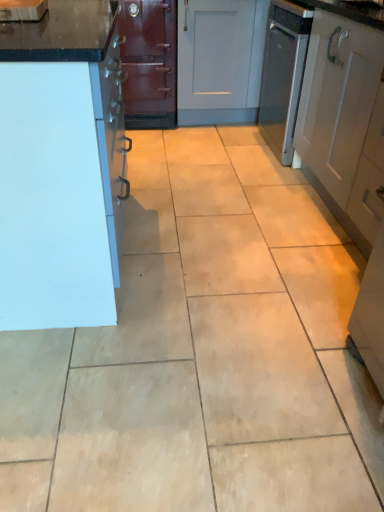
What do you see at coordinates (61, 167) in the screenshot? I see `white matte cabinet at left, which appears as the second cabinetry when viewed from the right` at bounding box center [61, 167].

Based on the photo, what is the approximate width of white matte cabinet at left, the 1th cabinetry from the left?

white matte cabinet at left, the 1th cabinetry from the left, is 75.01 centimeters wide.

Find the location of a particular element. This screenshot has height=512, width=384. white matte cabinet at left, which appears as the second cabinetry when viewed from the right is located at coordinates (61, 167).

This screenshot has height=512, width=384. What do you see at coordinates (342, 113) in the screenshot?
I see `white matte cabinet at right, which is the first cabinetry from right to left` at bounding box center [342, 113].

Measure the distance between white matte cabinet at right, positioned as the 2th cabinetry in left-to-right order, and camera.

white matte cabinet at right, positioned as the 2th cabinetry in left-to-right order, and camera are 1.54 meters apart.

This screenshot has width=384, height=512. I want to click on white matte cabinet at right, which is the first cabinetry from right to left, so click(342, 113).

Where is `white matte cabinet at left, which appears as the second cabinetry when viewed from the right`? white matte cabinet at left, which appears as the second cabinetry when viewed from the right is located at coordinates (61, 167).

Is white matte cabinet at left, which appears as the second cabinetry when viewed from the right, at the right side of white matte cabinet at right, which is the first cabinetry from right to left?

In fact, white matte cabinet at left, which appears as the second cabinetry when viewed from the right, is to the left of white matte cabinet at right, which is the first cabinetry from right to left.

Considering the relative positions of white matte cabinet at left, which appears as the second cabinetry when viewed from the right, and white matte cabinet at right, positioned as the 2th cabinetry in left-to-right order, in the image provided, is white matte cabinet at left, which appears as the second cabinetry when viewed from the right, in front of white matte cabinet at right, positioned as the 2th cabinetry in left-to-right order,?

That is True.

Which is in front, point (57, 5) or point (379, 216)?

The point (379, 216) is closer.

From the image's perspective, which object appears higher, white matte cabinet at left, the 1th cabinetry from the left, or white matte cabinet at right, which is the first cabinetry from right to left?

white matte cabinet at right, which is the first cabinetry from right to left, is shown above in the image.

From a real-world perspective, is white matte cabinet at left, the 1th cabinetry from the left, physically located above or below white matte cabinet at right, which is the first cabinetry from right to left?

white matte cabinet at left, the 1th cabinetry from the left, is situated lower than white matte cabinet at right, which is the first cabinetry from right to left, in the real world.

Which of these two, white matte cabinet at left, which appears as the second cabinetry when viewed from the right, or white matte cabinet at right, which is the first cabinetry from right to left, is thinner?

With smaller width is white matte cabinet at right, which is the first cabinetry from right to left.

Considering the sizes of white matte cabinet at left, the 1th cabinetry from the left, and white matte cabinet at right, which is the first cabinetry from right to left, in the image, is white matte cabinet at left, the 1th cabinetry from the left, taller or shorter than white matte cabinet at right, which is the first cabinetry from right to left,?

Clearly, white matte cabinet at left, the 1th cabinetry from the left, is shorter compared to white matte cabinet at right, which is the first cabinetry from right to left.

Based on their sizes in the image, would you say white matte cabinet at left, which appears as the second cabinetry when viewed from the right, is bigger or smaller than white matte cabinet at right, positioned as the 2th cabinetry in left-to-right order?

In the image, white matte cabinet at left, which appears as the second cabinetry when viewed from the right, appears to be larger than white matte cabinet at right, positioned as the 2th cabinetry in left-to-right order.

Is white matte cabinet at left, the 1th cabinetry from the left, surrounding white matte cabinet at right, positioned as the 2th cabinetry in left-to-right order?

Actually, white matte cabinet at right, positioned as the 2th cabinetry in left-to-right order, is outside white matte cabinet at left, the 1th cabinetry from the left.

Is white matte cabinet at left, which appears as the second cabinetry when viewed from the right, directly adjacent to white matte cabinet at right, which is the first cabinetry from right to left?

white matte cabinet at left, which appears as the second cabinetry when viewed from the right, is not next to white matte cabinet at right, which is the first cabinetry from right to left, and they're not touching.

Is white matte cabinet at left, which appears as the second cabinetry when viewed from the right, oriented away from white matte cabinet at right, positioned as the 2th cabinetry in left-to-right order?

Yes, white matte cabinet at left, which appears as the second cabinetry when viewed from the right, is positioned with its back facing white matte cabinet at right, positioned as the 2th cabinetry in left-to-right order.

Could you measure the distance between white matte cabinet at left, which appears as the second cabinetry when viewed from the right, and white matte cabinet at right, which is the first cabinetry from right to left?

The distance of white matte cabinet at left, which appears as the second cabinetry when viewed from the right, from white matte cabinet at right, which is the first cabinetry from right to left, is 1.04 meters.

I want to click on cabinetry located below the white matte cabinet at right, positioned as the 2th cabinetry in left-to-right order (from the image's perspective), so click(61, 167).

Visually, is white matte cabinet at right, positioned as the 2th cabinetry in left-to-right order, positioned to the left or to the right of white matte cabinet at left, the 1th cabinetry from the left?

white matte cabinet at right, positioned as the 2th cabinetry in left-to-right order, is positioned on white matte cabinet at left, the 1th cabinetry from the left,'s right side.

Considering the relative positions of white matte cabinet at right, which is the first cabinetry from right to left, and white matte cabinet at left, the 1th cabinetry from the left, in the image provided, is white matte cabinet at right, which is the first cabinetry from right to left, behind white matte cabinet at left, the 1th cabinetry from the left,?

Yes, the depth of white matte cabinet at right, which is the first cabinetry from right to left, is greater than that of white matte cabinet at left, the 1th cabinetry from the left.

Which point is more distant from viewer, (312, 63) or (91, 268)?

A: The point (312, 63) is farther from the camera.

From the image's perspective, is white matte cabinet at right, which is the first cabinetry from right to left, on white matte cabinet at left, which appears as the second cabinetry when viewed from the right?

Yes, from the image's perspective, white matte cabinet at right, which is the first cabinetry from right to left, is over white matte cabinet at left, which appears as the second cabinetry when viewed from the right.

From a real-world perspective, which object rests below the other?

In real-world perspective, white matte cabinet at left, which appears as the second cabinetry when viewed from the right, is lower.

Considering the sizes of objects white matte cabinet at right, which is the first cabinetry from right to left, and white matte cabinet at left, the 1th cabinetry from the left, in the image provided, who is thinner, white matte cabinet at right, which is the first cabinetry from right to left, or white matte cabinet at left, the 1th cabinetry from the left,?

Thinner between the two is white matte cabinet at right, which is the first cabinetry from right to left.

Based on the photo, considering the relative sizes of white matte cabinet at right, positioned as the 2th cabinetry in left-to-right order, and white matte cabinet at left, the 1th cabinetry from the left, in the image provided, is white matte cabinet at right, positioned as the 2th cabinetry in left-to-right order, taller than white matte cabinet at left, the 1th cabinetry from the left,?

Indeed, white matte cabinet at right, positioned as the 2th cabinetry in left-to-right order, has a greater height compared to white matte cabinet at left, the 1th cabinetry from the left.

Does white matte cabinet at right, which is the first cabinetry from right to left, have a larger size compared to white matte cabinet at left, which appears as the second cabinetry when viewed from the right?

Incorrect, white matte cabinet at right, which is the first cabinetry from right to left, is not larger than white matte cabinet at left, which appears as the second cabinetry when viewed from the right.

Is white matte cabinet at left, which appears as the second cabinetry when viewed from the right, surrounded by white matte cabinet at right, which is the first cabinetry from right to left?

No.

Is white matte cabinet at right, positioned as the 2th cabinetry in left-to-right order, next to white matte cabinet at left, which appears as the second cabinetry when viewed from the right?

No, white matte cabinet at right, positioned as the 2th cabinetry in left-to-right order, is not making contact with white matte cabinet at left, which appears as the second cabinetry when viewed from the right.

Is white matte cabinet at right, which is the first cabinetry from right to left, facing away from white matte cabinet at left, which appears as the second cabinetry when viewed from the right?

No.

Based on the photo, how different are the orientations of white matte cabinet at right, which is the first cabinetry from right to left, and white matte cabinet at left, which appears as the second cabinetry when viewed from the right, in degrees?

The facing directions of white matte cabinet at right, which is the first cabinetry from right to left, and white matte cabinet at left, which appears as the second cabinetry when viewed from the right, are 0.503 degrees apart.

Measure the distance between white matte cabinet at right, positioned as the 2th cabinetry in left-to-right order, and white matte cabinet at left, the 1th cabinetry from the left.

white matte cabinet at right, positioned as the 2th cabinetry in left-to-right order, is 3.43 feet away from white matte cabinet at left, the 1th cabinetry from the left.

Locate an element on the screen. This screenshot has width=384, height=512. cabinetry positioned vertically above the white matte cabinet at left, which appears as the second cabinetry when viewed from the right (from a real-world perspective) is located at coordinates (342, 113).

Where is `cabinetry below the white matte cabinet at right, which is the first cabinetry from right to left (from a real-world perspective)`? Image resolution: width=384 pixels, height=512 pixels. cabinetry below the white matte cabinet at right, which is the first cabinetry from right to left (from a real-world perspective) is located at coordinates (61, 167).

This screenshot has height=512, width=384. In order to click on cabinetry on the left of white matte cabinet at right, positioned as the 2th cabinetry in left-to-right order in this screenshot , I will do `click(61, 167)`.